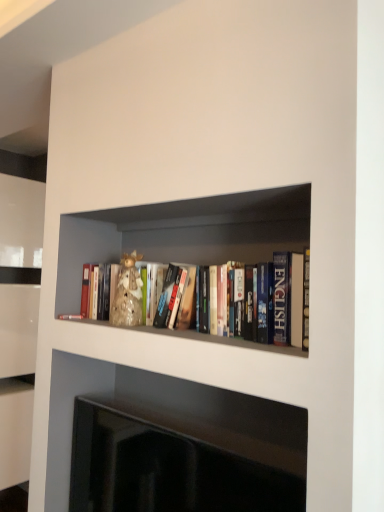
Question: Is black glossy fireplace at lower center in contact with hardcover books at center?

Choices:
 (A) no
 (B) yes

Answer: (A)

Question: From the image's perspective, is black glossy fireplace at lower center located above hardcover books at center?

Choices:
 (A) yes
 (B) no

Answer: (B)

Question: Would you say black glossy fireplace at lower center is a long distance from hardcover books at center?

Choices:
 (A) yes
 (B) no

Answer: (B)

Question: Is black glossy fireplace at lower center bigger than hardcover books at center?

Choices:
 (A) no
 (B) yes

Answer: (A)

Question: From a real-world perspective, is black glossy fireplace at lower center on hardcover books at center?

Choices:
 (A) yes
 (B) no

Answer: (B)

Question: Is the position of black glossy fireplace at lower center less distant than that of hardcover books at center?

Choices:
 (A) no
 (B) yes

Answer: (B)

Question: From a real-world perspective, is hardcover books at center under black glossy fireplace at lower center?

Choices:
 (A) no
 (B) yes

Answer: (A)

Question: Does hardcover books at center contain black glossy fireplace at lower center?

Choices:
 (A) no
 (B) yes

Answer: (A)

Question: Does hardcover books at center turn towards black glossy fireplace at lower center?

Choices:
 (A) yes
 (B) no

Answer: (B)

Question: Considering the relative positions of hardcover books at center and black glossy fireplace at lower center in the image provided, is hardcover books at center to the left of black glossy fireplace at lower center from the viewer's perspective?

Choices:
 (A) no
 (B) yes

Answer: (A)

Question: Is hardcover books at center positioned behind black glossy fireplace at lower center?

Choices:
 (A) yes
 (B) no

Answer: (A)

Question: Can you confirm if hardcover books at center is bigger than black glossy fireplace at lower center?

Choices:
 (A) yes
 (B) no

Answer: (A)

Question: Which is correct: black glossy fireplace at lower center is inside hardcover books at center, or outside of it?

Choices:
 (A) inside
 (B) outside

Answer: (B)